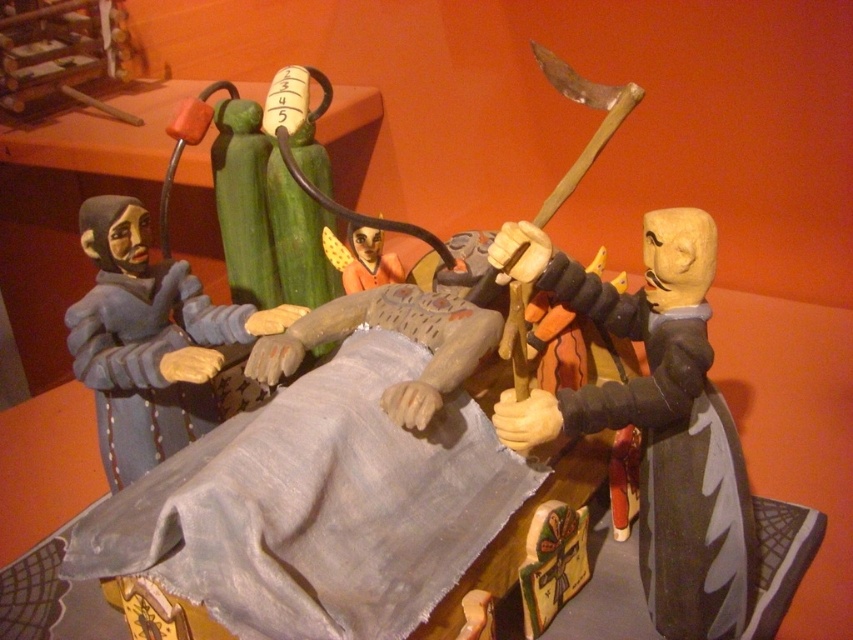
Consider the image. Where is the wooden figure at right located in the scene?

The wooden figure at right is located at point 0.652 in the x coordinate and 0.768 in the y coordinate.

You are a small toy car that is 3 inches long. You want to move from the wooden figure at right to the smooth gray fabric at center. Is there enough space for you to drive straight between them?

The distance between the wooden figure at right and the smooth gray fabric at center is 7.89 inches. Since the toy car is only 3 inches long, there is sufficient space for it to drive straight between them.

You are an observer standing in front of the display. There are two figures here, the matte gray figure at left and the orange fabric doll at center. Which one is closer to the front of the display?

The orange fabric doll at center is closer to the front of the display because the matte gray figure at left is positioned under it, meaning it is behind.